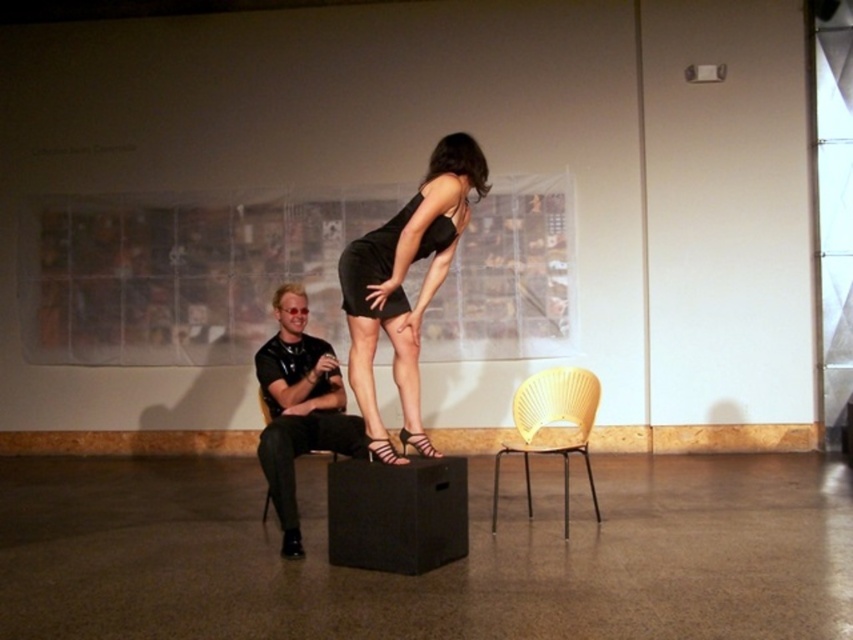
You are a GUI agent. You are given a task and a screenshot of the screen. Output one action in this format:
    pyautogui.click(x=<x>, y=<y>)
    Task: Click on the black satin dress at center
    This screenshot has height=640, width=853.
    Given the screenshot: What is the action you would take?
    405,273

Looking at this image, is black satin dress at center bigger than black leather shoe at lower center?

Yes.

What do you see at coordinates (405, 273) in the screenshot? I see `black satin dress at center` at bounding box center [405, 273].

At what (x,y) coordinates should I click in order to perform the action: click on black satin dress at center. Please return your answer as a coordinate pair (x, y). The width and height of the screenshot is (853, 640). Looking at the image, I should click on (405, 273).

From the picture: Can you confirm if yellow wood chair at center is thinner than shiny metallic sandal at center?

No, yellow wood chair at center is not thinner than shiny metallic sandal at center.

Who is more distant from viewer, (527, 410) or (393, 456)?

The point (527, 410) is more distant.

Who is more forward, (x=575, y=433) or (x=392, y=454)?

Positioned in front is point (x=392, y=454).

Where is `yellow wood chair at center`? Image resolution: width=853 pixels, height=640 pixels. yellow wood chair at center is located at coordinates (552, 422).

Does black satin dress at center have a larger size compared to black leather chair at center?

Yes, black satin dress at center is bigger than black leather chair at center.

The height and width of the screenshot is (640, 853). What do you see at coordinates (405, 273) in the screenshot?
I see `black satin dress at center` at bounding box center [405, 273].

Where is `black satin dress at center`? The image size is (853, 640). black satin dress at center is located at coordinates (405, 273).

At what (x,y) coordinates should I click in order to perform the action: click on black satin dress at center. Please return your answer as a coordinate pair (x, y). The height and width of the screenshot is (640, 853). Looking at the image, I should click on (405, 273).